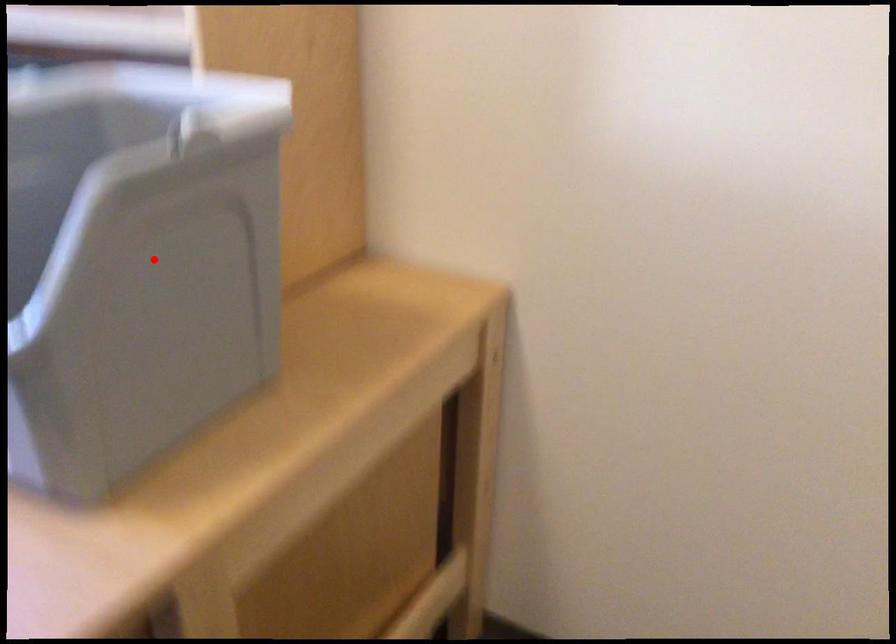
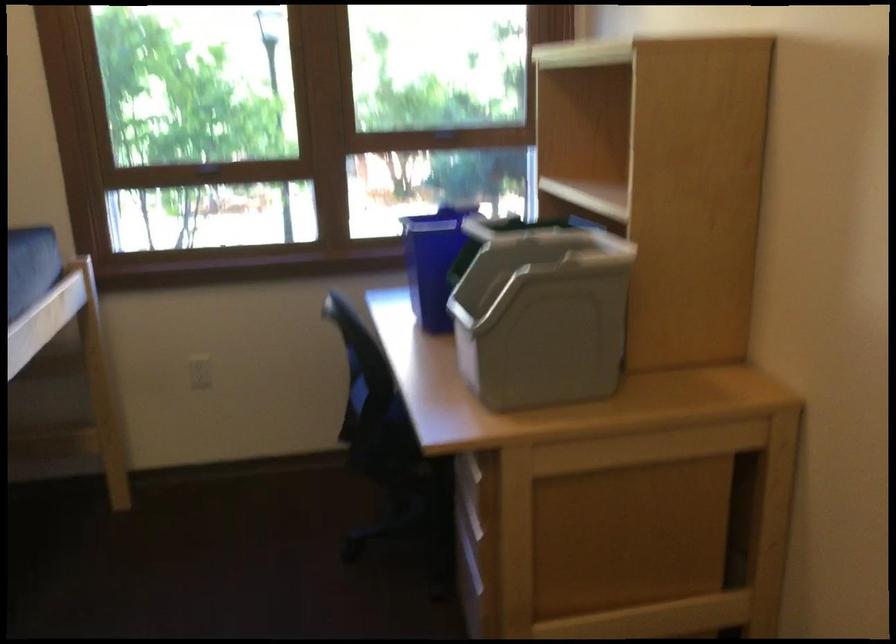
Question: I am providing you with two images of the same scene from different viewpoints. A red point is marked on the first image. Is the red point's position out of view in image 2?

Choices:
 (A) Yes
 (B) No

Answer: (B)